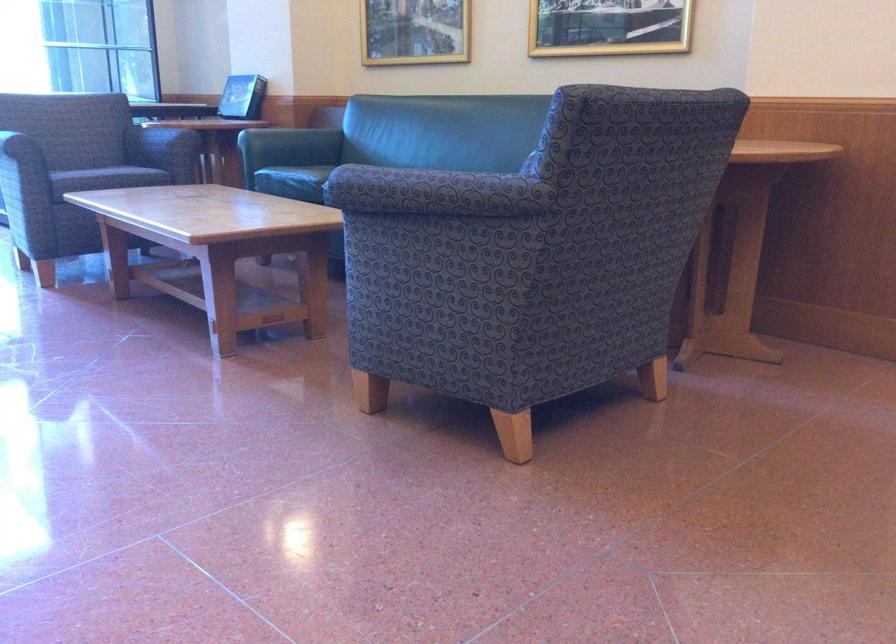
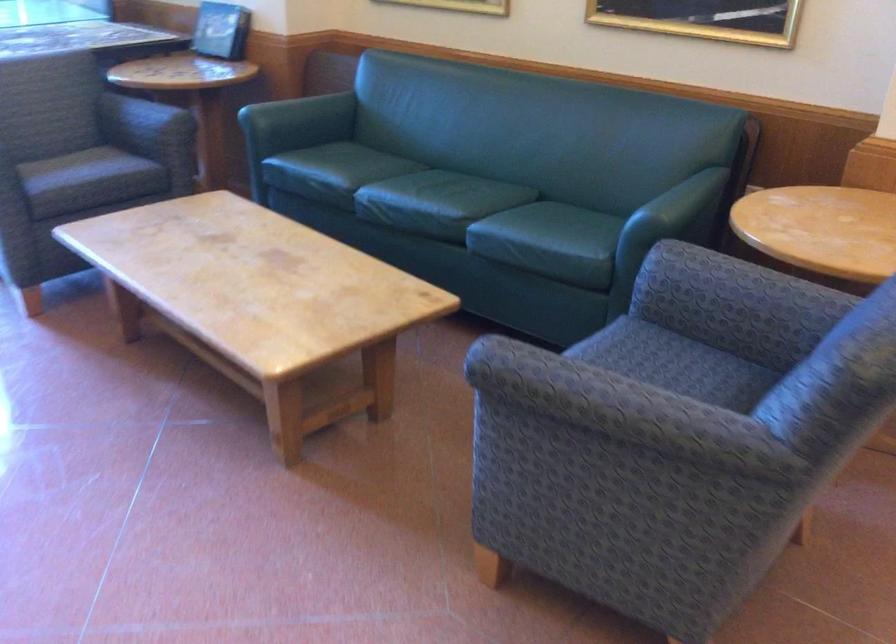
From the picture: In a continuous first-person perspective shot, in which direction is the camera moving?

The cameraman moved toward left, forward.